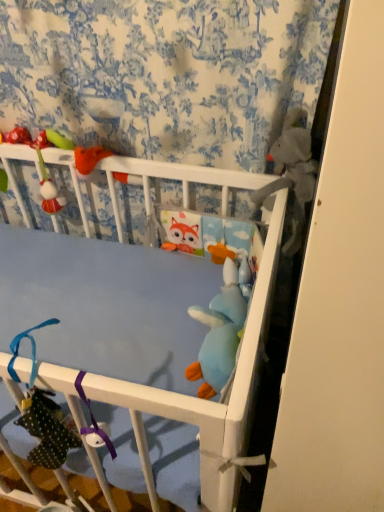
You are a GUI agent. You are given a task and a screenshot of the screen. Output one action in this format:
    pyautogui.click(x=<x>, y=<y>)
    Task: Click on the free space above soft blue plush toy at center, which appears as the 3th toy when viewed from the right (from a real-world perspective)
    Image resolution: width=384 pixels, height=512 pixels.
    Given the screenshot: What is the action you would take?
    pyautogui.click(x=228, y=318)